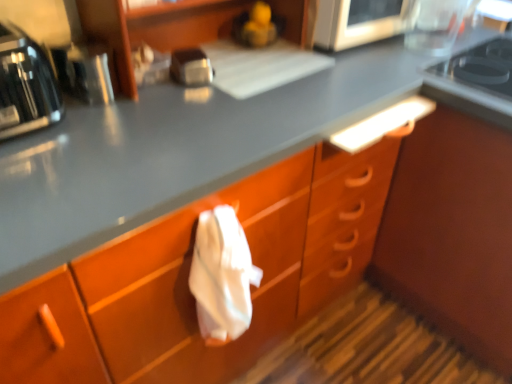
The width and height of the screenshot is (512, 384). I want to click on free space in front of wooden shelf at upper center, so click(x=184, y=127).